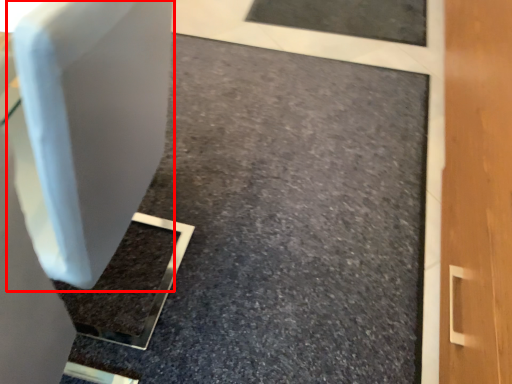
Question: Considering the relative positions of swivel chair (annotated by the red box) and concrete in the image provided, where is swivel chair (annotated by the red box) located with respect to the staircase?

Choices:
 (A) left
 (B) right

Answer: (A)